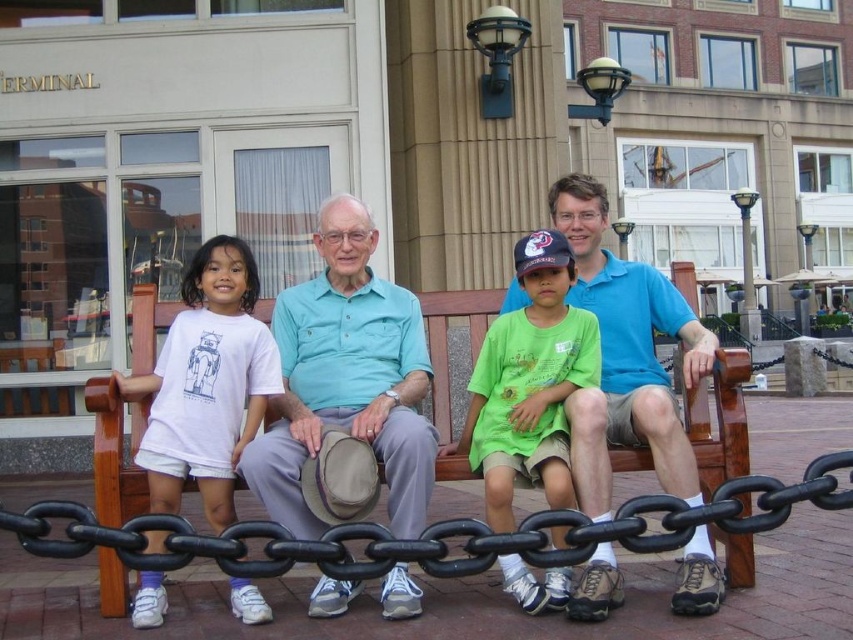
Question: Which object is farther from the camera taking this photo?

Choices:
 (A) light blue cotton shirt at center
 (B) white cotton shirt at left
 (C) matte blue shirt at center
 (D) green cotton shirt at center

Answer: (B)

Question: Which point is closer to the camera taking this photo?

Choices:
 (A) (230, 280)
 (B) (357, 300)
 (C) (552, 492)

Answer: (C)

Question: From the image, what is the correct spatial relationship of light blue cotton shirt at center in relation to white cotton shirt at left?

Choices:
 (A) right
 (B) left

Answer: (A)

Question: Which object appears closest to the camera in this image?

Choices:
 (A) blue cotton shirt at center
 (B) matte blue shirt at center

Answer: (A)

Question: Considering the relative positions of blue cotton shirt at center and green cotton shirt at center in the image provided, where is blue cotton shirt at center located with respect to green cotton shirt at center?

Choices:
 (A) right
 (B) left

Answer: (A)

Question: Is matte blue shirt at center closer to the viewer compared to light blue cotton shirt at center?

Choices:
 (A) yes
 (B) no

Answer: (A)